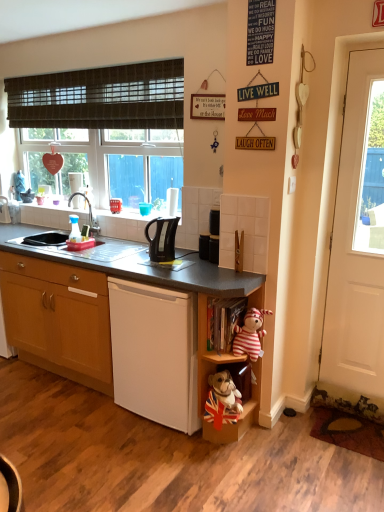
Image resolution: width=384 pixels, height=512 pixels. What are the coordinates of `vacant space to the left of black plastic kettle at center` in the screenshot? It's located at (185, 254).